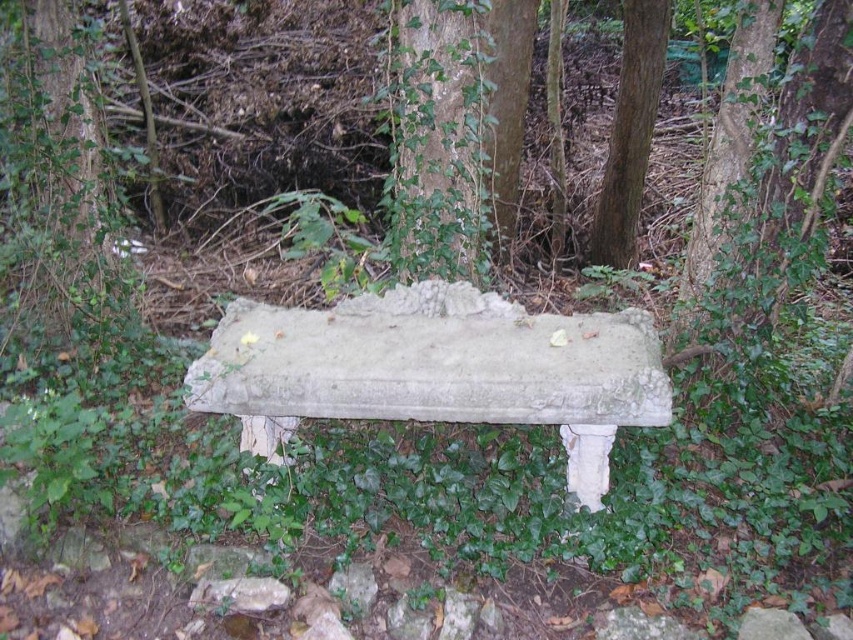
Does gray concrete bench at center appear on the left side of smooth brown tree trunk at center right?

Yes, gray concrete bench at center is to the left of smooth brown tree trunk at center right.

Who is more forward, (x=393, y=314) or (x=627, y=172)?

Positioned in front is point (x=393, y=314).

Which is in front, point (424, 353) or point (630, 42)?

Positioned in front is point (424, 353).

I want to click on gray concrete bench at center, so click(x=436, y=369).

Looking at this image, is green leafy tree at left closer to camera compared to smooth brown tree trunk at center right?

Yes, it is in front of smooth brown tree trunk at center right.

Does green leafy tree at left appear on the left side of smooth brown tree trunk at center right?

Correct, you'll find green leafy tree at left to the left of smooth brown tree trunk at center right.

Who is more forward, (x=74, y=44) or (x=640, y=81)?

Positioned in front is point (x=74, y=44).

The image size is (853, 640). I want to click on green leafy tree at left, so click(51, 170).

What do you see at coordinates (436, 369) in the screenshot? This screenshot has height=640, width=853. I see `gray concrete bench at center` at bounding box center [436, 369].

Is gray concrete bench at center to the right of green leafy tree at left from the viewer's perspective?

Correct, you'll find gray concrete bench at center to the right of green leafy tree at left.

Does point (405, 397) come in front of point (18, 276)?

That is True.

Where is `gray concrete bench at center`? gray concrete bench at center is located at coordinates (436, 369).